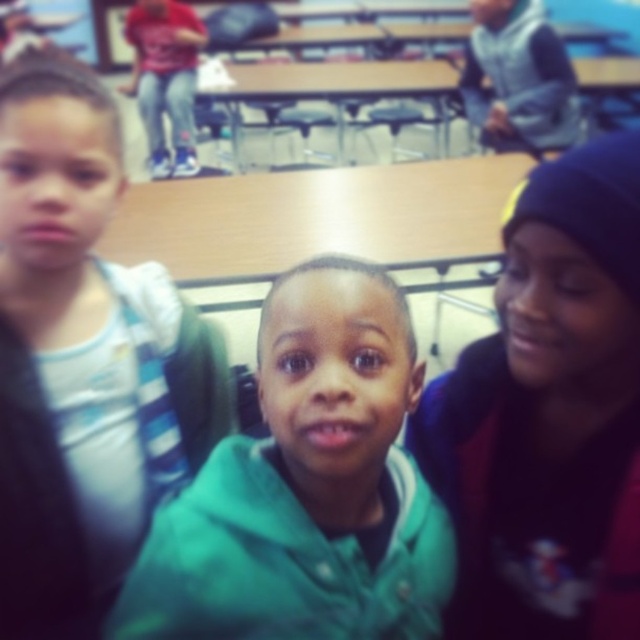
Question: Does green fleece jacket at center appear on the left side of wooden table at center?

Choices:
 (A) no
 (B) yes

Answer: (B)

Question: Is green matte hoodie at center to the right of green fleece jacket at center from the viewer's perspective?

Choices:
 (A) yes
 (B) no

Answer: (B)

Question: Does green fleece jacket at center have a greater width compared to wooden table at center?

Choices:
 (A) yes
 (B) no

Answer: (B)

Question: Among these points, which one is farthest from the camera?

Choices:
 (A) (456, 86)
 (B) (301, 602)
 (C) (81, 600)

Answer: (A)

Question: Which object is the closest to the wooden table at center?

Choices:
 (A) dark blue knit cap at upper right
 (B) green fleece jacket at center

Answer: (A)

Question: Estimate the real-world distances between objects in this image. Which object is farther from the wooden table at center?

Choices:
 (A) green fleece jacket at center
 (B) dark blue knit cap at upper right
 (C) green matte hoodie at center

Answer: (A)